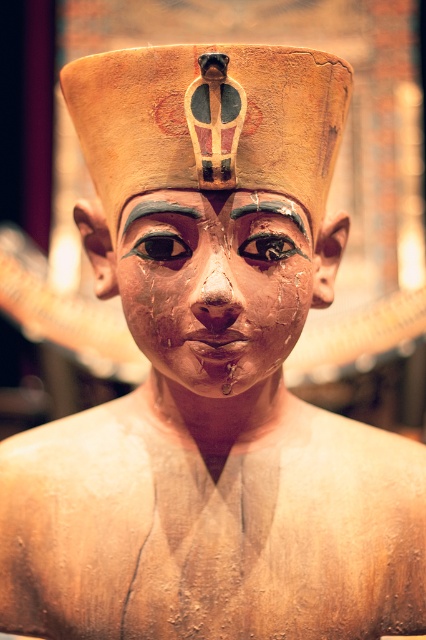
Can you confirm if matte wood face at center is positioned to the right of matte gold eye at center?

Correct, you'll find matte wood face at center to the right of matte gold eye at center.

Is point (216, 374) closer to viewer compared to point (187, 248)?

No, (216, 374) is further to viewer.

Is point (290, 269) more distant than point (158, 248)?

Yes, point (290, 269) is farther from viewer.

Identify the location of matte wood face at center. This screenshot has height=640, width=426. (215, 284).

Between matte clay head at center and shiny black eye at center, which one appears on the right side from the viewer's perspective?

From the viewer's perspective, shiny black eye at center appears more on the right side.

Does point (118, 128) come farther from viewer compared to point (296, 252)?

That is False.

Where is `matte clay head at center`? Image resolution: width=426 pixels, height=640 pixels. matte clay head at center is located at coordinates (209, 122).

Who is positioned more to the right, matte wood face at center or matte gold forehead at center?

From the viewer's perspective, matte gold forehead at center appears more on the right side.

Consider the image. Does matte wood face at center have a larger size compared to matte gold forehead at center?

Yes.

Does point (175, 339) lie behind point (173, 193)?

Yes.

Where is `matte wood face at center`? matte wood face at center is located at coordinates (215, 284).